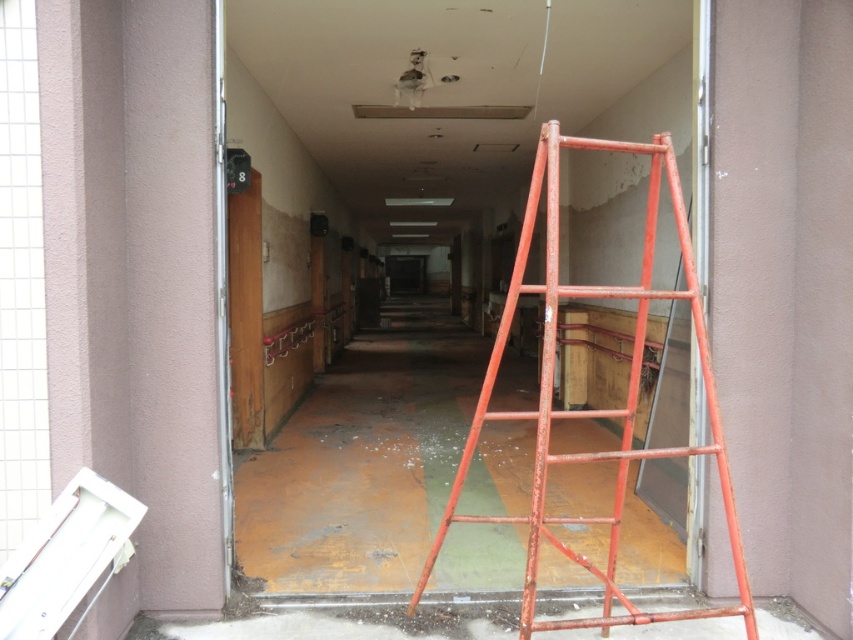
Question: Is rusty metal ladder at right above rusty metal door at left?

Choices:
 (A) yes
 (B) no

Answer: (B)

Question: Which of the following is the farthest from the observer?

Choices:
 (A) rusty metal ladder at right
 (B) rusty metal door at left

Answer: (B)

Question: Is rusty metal ladder at right to the right of rusty metal door at left from the viewer's perspective?

Choices:
 (A) no
 (B) yes

Answer: (B)

Question: Which point appears farthest from the camera in this image?

Choices:
 (A) [585, 564]
 (B) [253, 362]

Answer: (B)

Question: Is the position of rusty metal ladder at right less distant than that of rusty metal door at left?

Choices:
 (A) yes
 (B) no

Answer: (A)